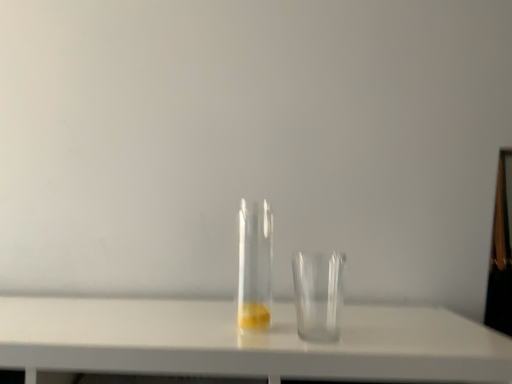
Question: Is the position of transparent glass tube at center more distant than that of transparent glass cup at center?

Choices:
 (A) no
 (B) yes

Answer: (B)

Question: Does transparent glass tube at center appear on the right side of transparent glass cup at center?

Choices:
 (A) yes
 (B) no

Answer: (B)

Question: Considering the relative positions of transparent glass tube at center and transparent glass cup at center in the image provided, is transparent glass tube at center in front of transparent glass cup at center?

Choices:
 (A) no
 (B) yes

Answer: (A)

Question: From the image's perspective, does transparent glass tube at center appear higher than transparent glass cup at center?

Choices:
 (A) yes
 (B) no

Answer: (A)

Question: Considering the relative sizes of transparent glass tube at center and transparent glass cup at center in the image provided, is transparent glass tube at center taller than transparent glass cup at center?

Choices:
 (A) no
 (B) yes

Answer: (B)

Question: Is transparent glass tube at center shorter than transparent glass cup at center?

Choices:
 (A) yes
 (B) no

Answer: (B)

Question: Considering the relative sizes of transparent glass cup at center and transparent glass tube at center in the image provided, is transparent glass cup at center thinner than transparent glass tube at center?

Choices:
 (A) yes
 (B) no

Answer: (B)

Question: From a real-world perspective, is transparent glass cup at center below transparent glass tube at center?

Choices:
 (A) no
 (B) yes

Answer: (B)

Question: Is transparent glass cup at center positioned beyond the bounds of transparent glass tube at center?

Choices:
 (A) no
 (B) yes

Answer: (B)

Question: Could you tell me if transparent glass cup at center is turned towards transparent glass tube at center?

Choices:
 (A) yes
 (B) no

Answer: (B)

Question: From the image's perspective, does transparent glass cup at center appear higher than transparent glass tube at center?

Choices:
 (A) no
 (B) yes

Answer: (A)

Question: Is transparent glass cup at center positioned before transparent glass tube at center?

Choices:
 (A) yes
 (B) no

Answer: (A)

Question: Looking at the image, does transparent glass cup at center seem bigger or smaller compared to transparent glass tube at center?

Choices:
 (A) big
 (B) small

Answer: (B)